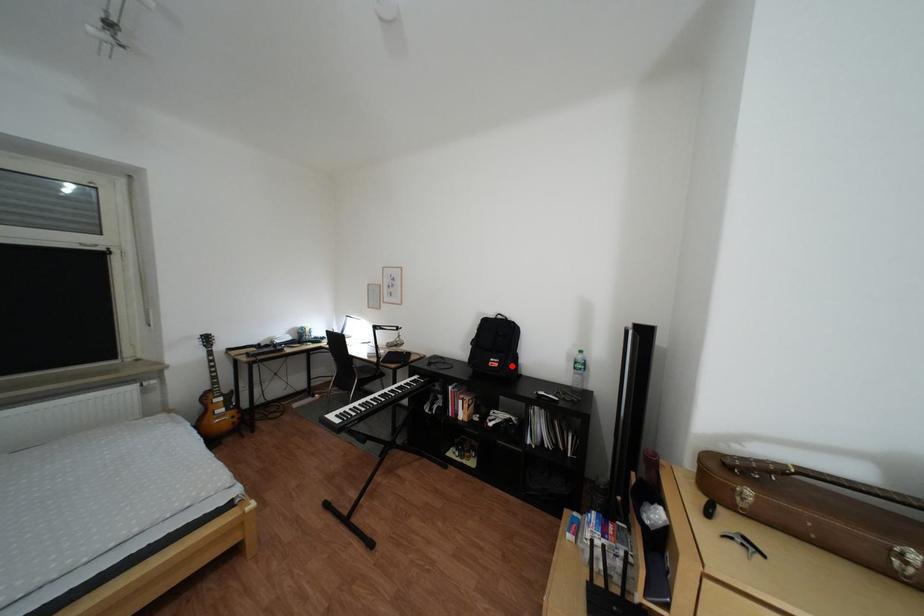
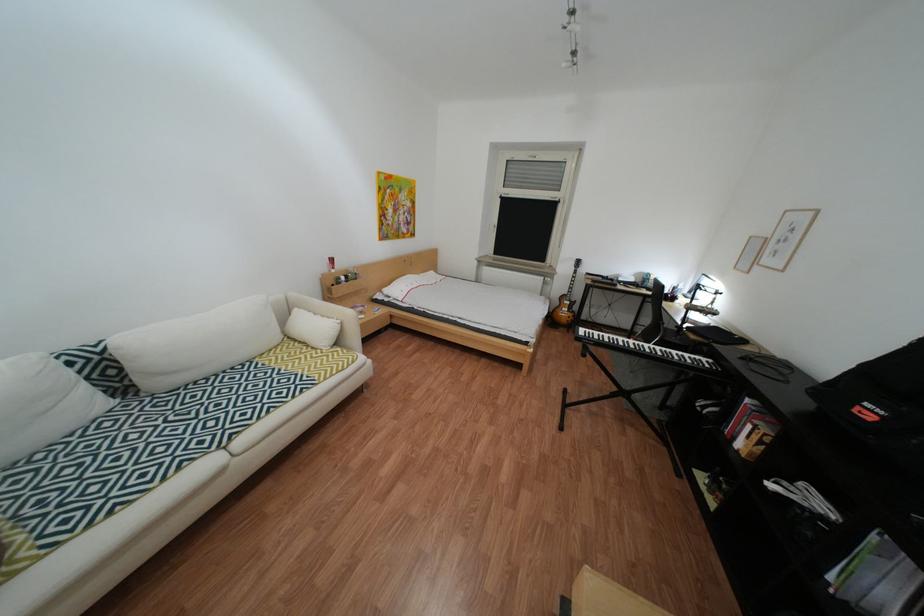
Where in the second image is the point corresponding to the highlighted location from the first image?

(886, 419)